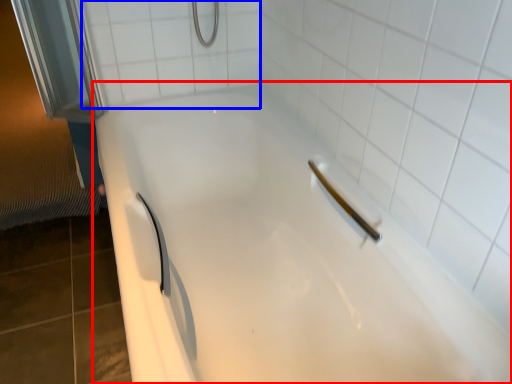
Question: Which point is closer to the camera, bathtub (highlighted by a red box) or ceramic tile (highlighted by a blue box)?

Choices:
 (A) bathtub
 (B) ceramic tile

Answer: (A)